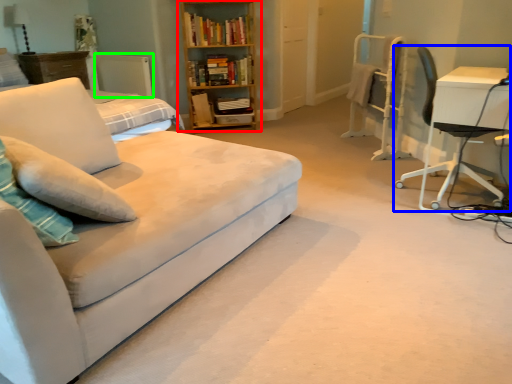
Question: Estimate the real-world distances between objects in this image. Which object is farther from bookcase (highlighted by a red box), chair (highlighted by a blue box) or radiator (highlighted by a green box)?

Choices:
 (A) chair
 (B) radiator

Answer: (A)